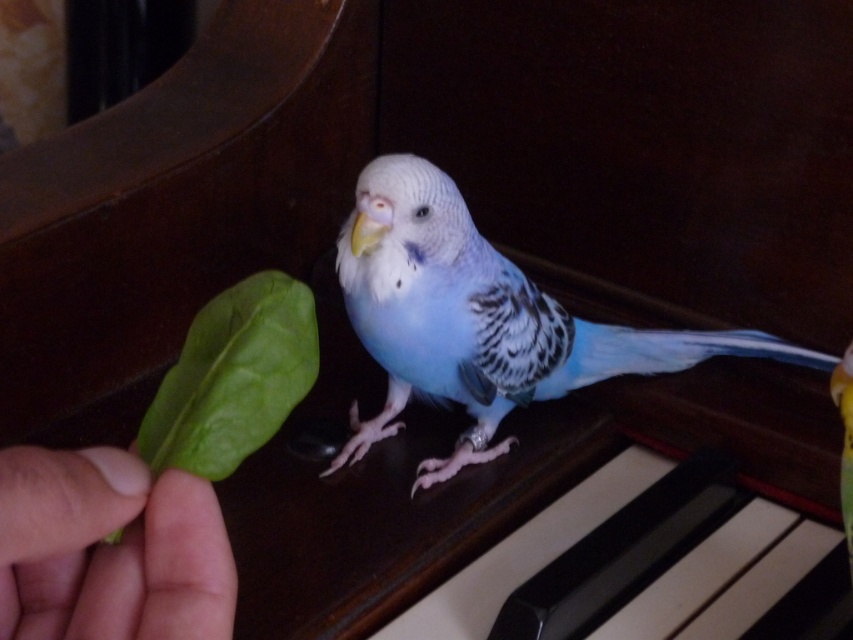
Does light blue feathered parrot at center have a greater width compared to blue glossy parrot at center?

Indeed, light blue feathered parrot at center has a greater width compared to blue glossy parrot at center.

Based on the photo, can you confirm if light blue feathered parrot at center is positioned above blue glossy parrot at center?

Indeed, light blue feathered parrot at center is positioned over blue glossy parrot at center.

Is point (422, 328) positioned before point (843, 467)?

No, (422, 328) is further to viewer.

Find the location of `light blue feathered parrot at center`. light blue feathered parrot at center is located at coordinates (480, 320).

Which is more to the left, light blue feathered parrot at center or green leafy at center?

green leafy at center

Which of these two, light blue feathered parrot at center or green leafy at center, stands shorter?

green leafy at center

Who is more distant from viewer, (386,420) or (248,422)?

The point (386,420) is behind.

Find the location of a particular element. The width and height of the screenshot is (853, 640). light blue feathered parrot at center is located at coordinates (480, 320).

Can you confirm if green leafy at left is smaller than green leafy at center?

No, green leafy at left is not smaller than green leafy at center.

Between point (99, 573) and point (274, 356), which one is positioned in front?

Point (99, 573)

Find the location of a particular element. green leafy at left is located at coordinates (109, 548).